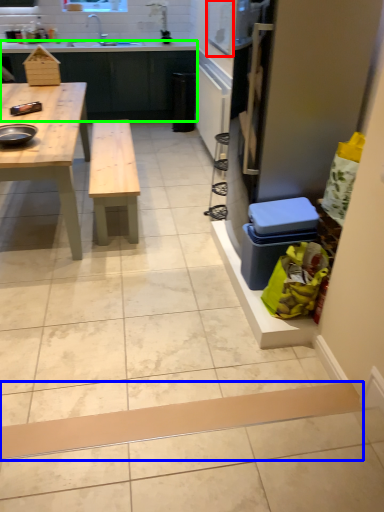
Question: Considering the real-world distances, which object is closest to window screen (highlighted by a red box)? plank (highlighted by a blue box) or counter (highlighted by a green box).

Choices:
 (A) plank
 (B) counter

Answer: (B)